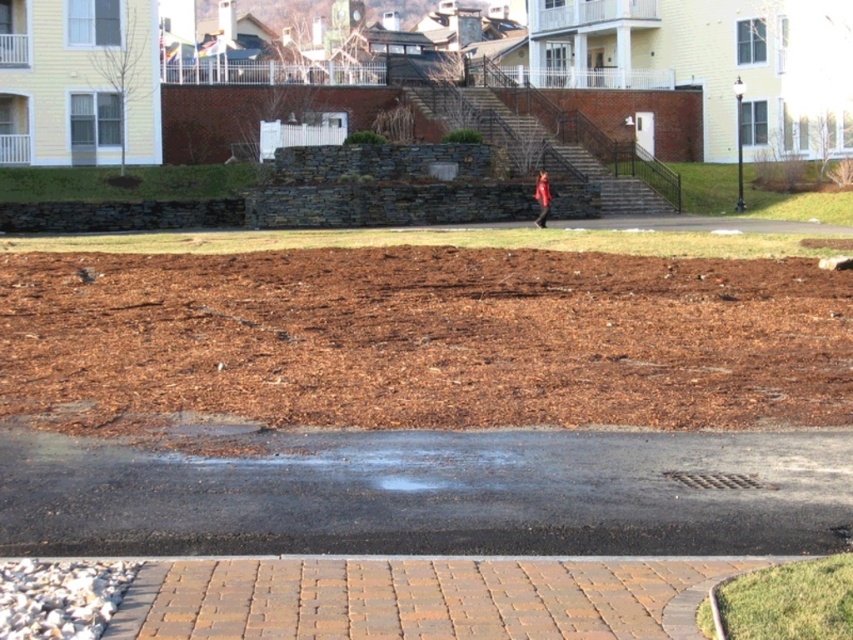
Does black asphalt at lower center have a lesser height compared to brown stone stairs at center?

Correct, black asphalt at lower center is not as tall as brown stone stairs at center.

Who is positioned more to the right, black asphalt at lower center or brown stone stairs at center?

brown stone stairs at center is more to the right.

Locate an element on the screen. The image size is (853, 640). black asphalt at lower center is located at coordinates (433, 493).

Is brown mulch at center further to the viewer compared to red fabric person at center?

No, brown mulch at center is closer to the viewer.

Between brown mulch at center and red fabric person at center, which one is positioned lower?

brown mulch at center is lower down.

Who is more distant from viewer, (x=601, y=257) or (x=544, y=214)?

Positioned behind is point (x=544, y=214).

You are a GUI agent. You are given a task and a screenshot of the screen. Output one action in this format:
    pyautogui.click(x=<x>, y=<y>)
    Task: Click on the brown mulch at center
    This screenshot has width=853, height=640.
    Given the screenshot: What is the action you would take?
    tap(424, 339)

Who is positioned more to the right, brown stone stairs at center or red fabric person at center?

brown stone stairs at center

Locate an element on the screen. The height and width of the screenshot is (640, 853). brown stone stairs at center is located at coordinates (541, 147).

Measure the distance between point (616, 196) and camera.

They are 46.66 meters apart.

At what (x,y) coordinates should I click in order to perform the action: click on brown stone stairs at center. Please return your answer as a coordinate pair (x, y). Looking at the image, I should click on (541, 147).